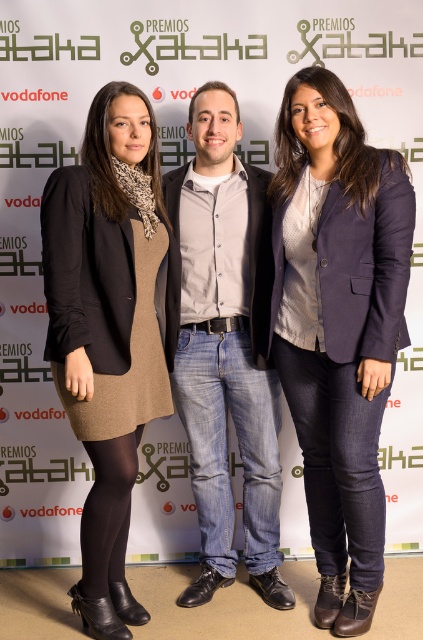
Who is shorter, navy blue blazer at center or matte black blazer at left?

Standing shorter between the two is matte black blazer at left.

Which is in front, point (365, 490) or point (102, 579)?

Positioned in front is point (365, 490).

You are a GUI agent. You are given a task and a screenshot of the screen. Output one action in this format:
    pyautogui.click(x=<x>, y=<y>)
    Task: Click on the navy blue blazer at center
    
    Given the screenshot: What is the action you would take?
    pyautogui.click(x=338, y=324)

Does navy blue blazer at center lie in front of denim jeans at center?

Yes, navy blue blazer at center is in front of denim jeans at center.

Is the position of navy blue blazer at center more distant than that of denim jeans at center?

No, navy blue blazer at center is closer to the viewer.

Between point (310, 301) and point (200, 99), which one is positioned behind?

Point (200, 99)

Where is `navy blue blazer at center`? This screenshot has width=423, height=640. navy blue blazer at center is located at coordinates (338, 324).

Does matte black blazer at left have a greater width compared to denim jeans at center?

No.

Does point (131, 481) come in front of point (192, 380)?

That is True.

The image size is (423, 640). Identify the location of matte black blazer at left. (109, 328).